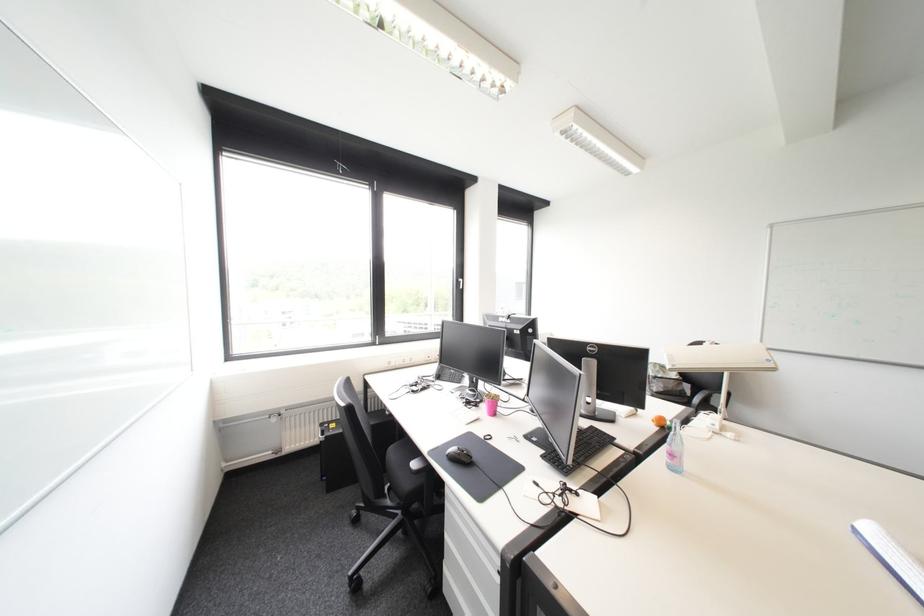
The height and width of the screenshot is (616, 924). What do you see at coordinates (459, 281) in the screenshot?
I see `the window handle` at bounding box center [459, 281].